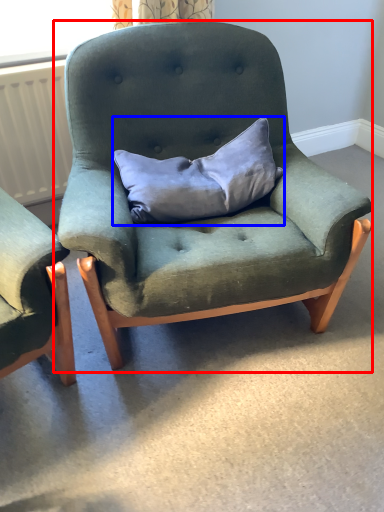
Question: Which object is further to the camera taking this photo, chair (highlighted by a red box) or pillow (highlighted by a blue box)?

Choices:
 (A) chair
 (B) pillow

Answer: (B)